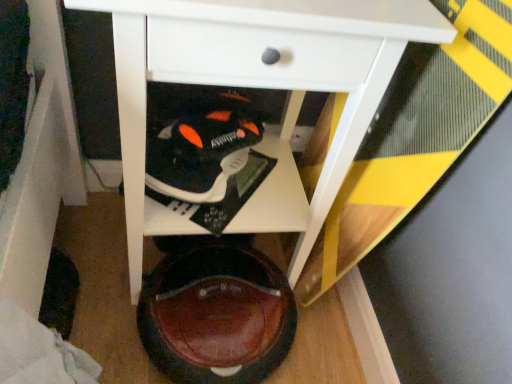
Question: Considering the positions of black matte sneaker at center, positioned as the 1th footwear in top-to-bottom order, and brown leather shoe at lower center, which is counted as the second footwear, starting from the top, in the image, is black matte sneaker at center, positioned as the 1th footwear in top-to-bottom order, wider or thinner than brown leather shoe at lower center, which is counted as the second footwear, starting from the top,?

Choices:
 (A) wide
 (B) thin

Answer: (B)

Question: Is black matte sneaker at center, arranged as the 2th footwear when ordered from the bottom, taller or shorter than brown leather shoe at lower center, which is counted as the second footwear, starting from the top?

Choices:
 (A) tall
 (B) short

Answer: (B)

Question: Which object is positioned farthest from the white glossy table at center?

Choices:
 (A) brown leather shoe at lower center, which is counted as the second footwear, starting from the top
 (B) black matte sneaker at center, arranged as the 2th footwear when ordered from the bottom

Answer: (A)

Question: Which object is the farthest from the black matte sneaker at center, arranged as the 2th footwear when ordered from the bottom?

Choices:
 (A) brown leather shoe at lower center, arranged as the 1th footwear when ordered from the bottom
 (B) white glossy table at center

Answer: (A)